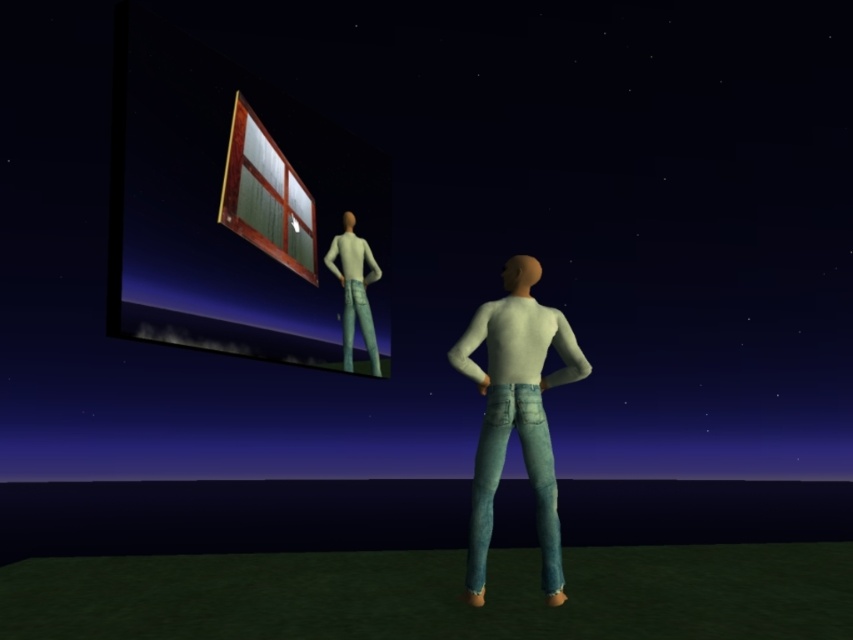
Can you confirm if light blue denim jeans at center is thinner than white matte shirt at upper center?

Incorrect, light blue denim jeans at center's width is not less than white matte shirt at upper center's.

Is point (535, 282) positioned in front of point (341, 214)?

That is True.

Identify the location of light blue denim jeans at center. (515, 412).

Consider the image. Is wooden frame at upper center to the left of white matte shirt at upper center from the viewer's perspective?

Yes, wooden frame at upper center is to the left of white matte shirt at upper center.

Does wooden frame at upper center appear over white matte shirt at upper center?

Indeed, wooden frame at upper center is positioned over white matte shirt at upper center.

Which is behind, point (271, 177) or point (358, 280)?

The point (358, 280) is behind.

Find the location of a particular element. wooden frame at upper center is located at coordinates (265, 195).

Can you confirm if light blue denim jeans at center is positioned below wooden frame at upper center?

Correct, light blue denim jeans at center is located below wooden frame at upper center.

Which is in front, point (492, 440) or point (236, 209)?

Point (492, 440)

The width and height of the screenshot is (853, 640). What are the coordinates of `light blue denim jeans at center` in the screenshot? It's located at (515, 412).